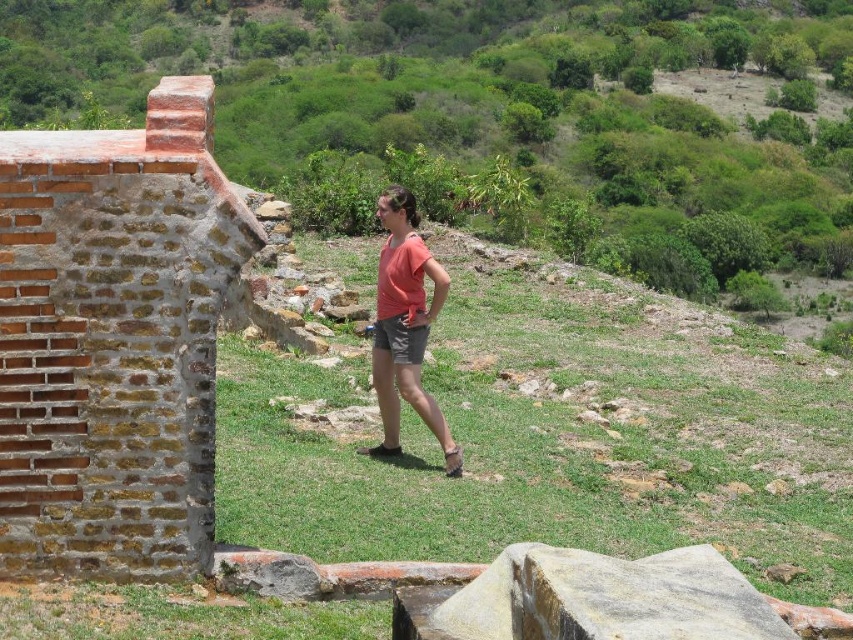
Between matte coral t-shirt at center and gray cotton shorts at center, which one has less height?

Standing shorter between the two is gray cotton shorts at center.

Measure the distance between point (447, 284) and camera.

Point (447, 284) is 12.02 meters from camera.

Find the location of a particular element. matte coral t-shirt at center is located at coordinates coord(405,326).

Consider the image. Is green grassy at center shorter than gray cotton shorts at center?

Incorrect, green grassy at center's height does not fall short of gray cotton shorts at center's.

Does point (764, 388) lie behind point (419, 348)?

Yes, point (764, 388) is behind point (419, 348).

Measure the distance between green grassy at center and camera.

green grassy at center is 30.88 feet away from camera.

The height and width of the screenshot is (640, 853). Identify the location of green grassy at center. (556, 440).

Between green grassy at center and matte coral t-shirt at center, which one has less height?

matte coral t-shirt at center is shorter.

Who is more distant from viewer, (630, 358) or (415, 381)?

Point (630, 358)

Describe the element at coordinates (556, 440) in the screenshot. I see `green grassy at center` at that location.

Where is `green grassy at center`? The image size is (853, 640). green grassy at center is located at coordinates (556, 440).